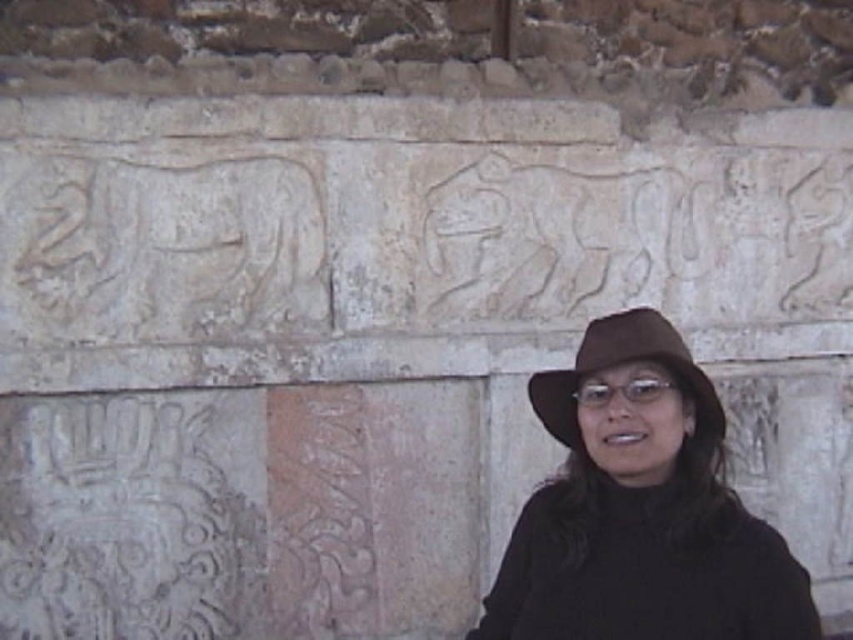
Question: Does black felt hat at center have a smaller size compared to brown felt fedora at center?

Choices:
 (A) no
 (B) yes

Answer: (A)

Question: Can you confirm if black felt hat at center is positioned to the right of brown felt fedora at center?

Choices:
 (A) yes
 (B) no

Answer: (B)

Question: Which point appears farthest from the camera in this image?

Choices:
 (A) (703, 392)
 (B) (635, 531)

Answer: (B)

Question: Is black felt hat at center positioned at the back of brown felt fedora at center?

Choices:
 (A) yes
 (B) no

Answer: (B)

Question: Which object is farther from the camera taking this photo?

Choices:
 (A) brown felt fedora at center
 (B) black felt hat at center

Answer: (A)